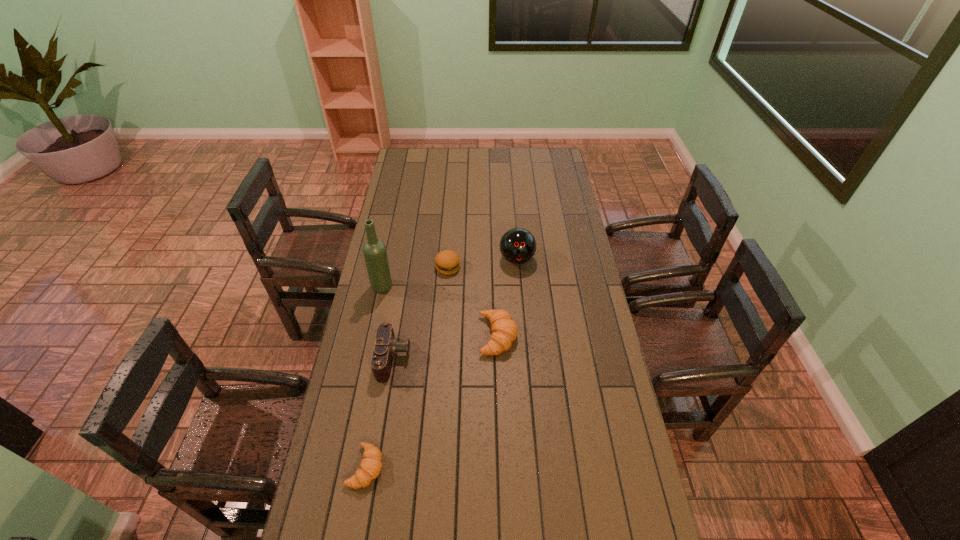
In order to click on the left crescent roll in this screenshot , I will do `click(371, 465)`.

Locate an element on the screen. The width and height of the screenshot is (960, 540). the shortest object is located at coordinates (371, 465).

The width and height of the screenshot is (960, 540). I want to click on the right crescent roll, so click(x=504, y=330).

At what (x,y) coordinates should I click in order to perform the action: click on the taller crescent roll. Please return your answer as a coordinate pair (x, y). Looking at the image, I should click on (504, 330).

Identify the location of wine bottle. The image size is (960, 540). (374, 250).

Identify the location of the fourth nearest object. This screenshot has width=960, height=540. (374, 250).

The height and width of the screenshot is (540, 960). I want to click on camera, so click(x=386, y=346).

Locate an element on the screen. This screenshot has height=540, width=960. the fourth object from left to right is located at coordinates click(x=447, y=262).

Where is `the fifth shortest object`? This screenshot has width=960, height=540. the fifth shortest object is located at coordinates (518, 245).

The width and height of the screenshot is (960, 540). I want to click on free space located 0.070m on the back of the nearest object, so click(373, 422).